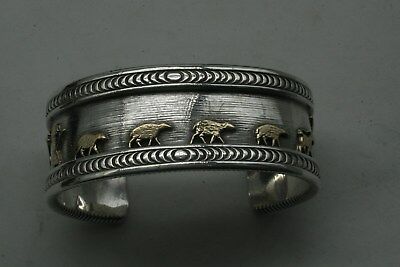
Locate an element on the screen. This screenshot has height=267, width=400. table is located at coordinates (28, 192), (195, 243), (345, 129), (215, 36).